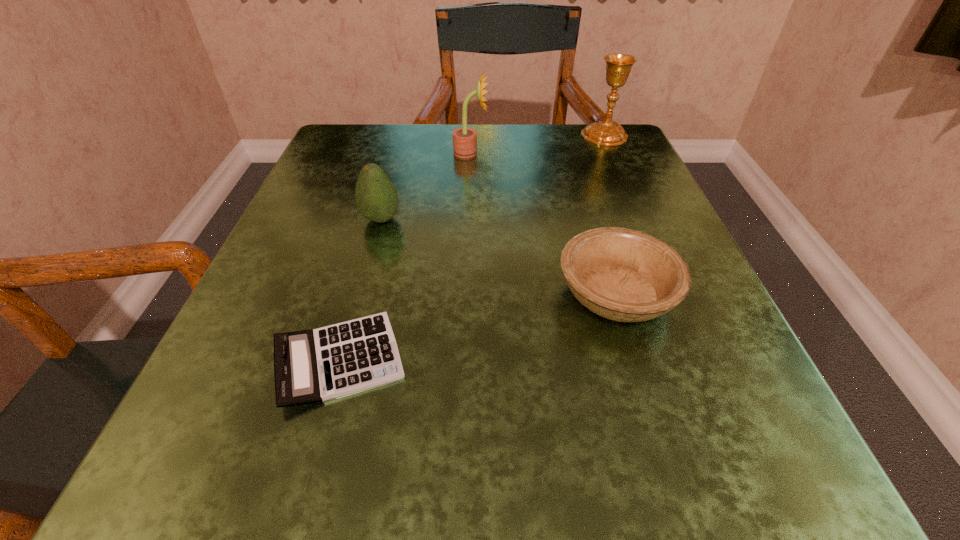
Where is `vacant region located on the right of the shortest object`? vacant region located on the right of the shortest object is located at coordinates (609, 360).

Image resolution: width=960 pixels, height=540 pixels. What are the coordinates of `sunflower present at the far edge` in the screenshot? It's located at (464, 139).

You are a GUI agent. You are given a task and a screenshot of the screen. Output one action in this format:
    pyautogui.click(x=<x>, y=<y>)
    Task: Click on the chalice at the far edge
    The width and height of the screenshot is (960, 540).
    Given the screenshot: What is the action you would take?
    pyautogui.click(x=618, y=66)

The image size is (960, 540). I want to click on avocado that is at the left edge, so click(x=376, y=197).

Where is `calculator positioned at the left edge`? This screenshot has height=540, width=960. calculator positioned at the left edge is located at coordinates (310, 366).

I want to click on chalice located in the right edge section of the desktop, so click(x=618, y=66).

At what (x,y) coordinates should I click in order to perform the action: click on bowl situated at the right edge. Please return your answer as a coordinate pair (x, y). The width and height of the screenshot is (960, 540). Looking at the image, I should click on 625,275.

You are a GUI agent. You are given a task and a screenshot of the screen. Output one action in this format:
    pyautogui.click(x=<x>, y=<y>)
    Task: Click on the object that is at the far right corner
    
    Given the screenshot: What is the action you would take?
    pyautogui.click(x=618, y=66)

The width and height of the screenshot is (960, 540). I want to click on vacant space at the far edge, so click(512, 133).

The width and height of the screenshot is (960, 540). I want to click on vacant space at the near edge of the desktop, so click(392, 464).